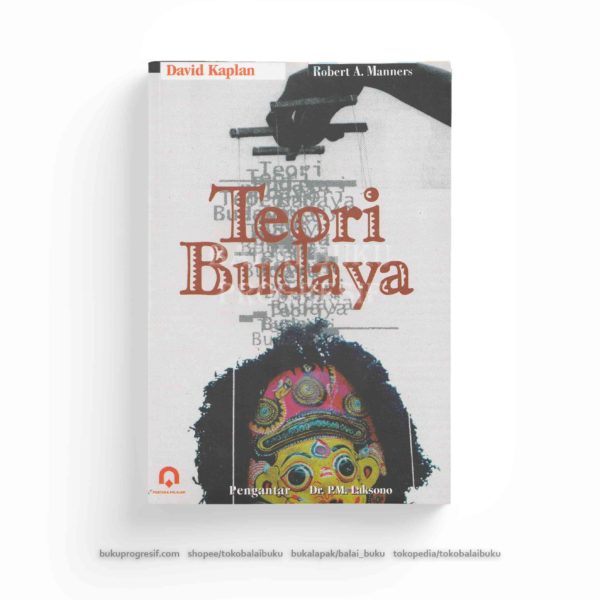
You are a GUI agent. You are given a task and a screenshot of the screen. Output one action in this format:
    pyautogui.click(x=<x>, y=<y>)
    Task: Click on the wooden parts
    
    Given the screenshot: What is the action you would take?
    pyautogui.click(x=312, y=97), pyautogui.click(x=342, y=125), pyautogui.click(x=287, y=149), pyautogui.click(x=257, y=129)